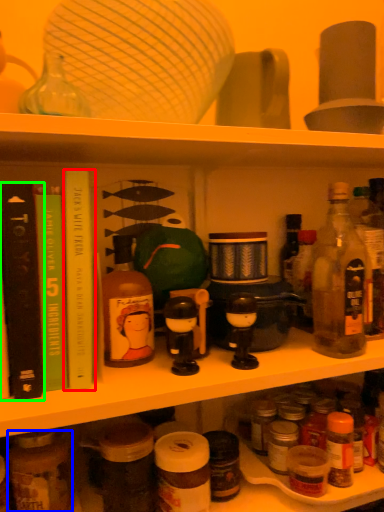
Question: Which is farther away from book (highlighted by a red box)? bottle (highlighted by a blue box) or book (highlighted by a green box)?

Choices:
 (A) bottle
 (B) book

Answer: (A)